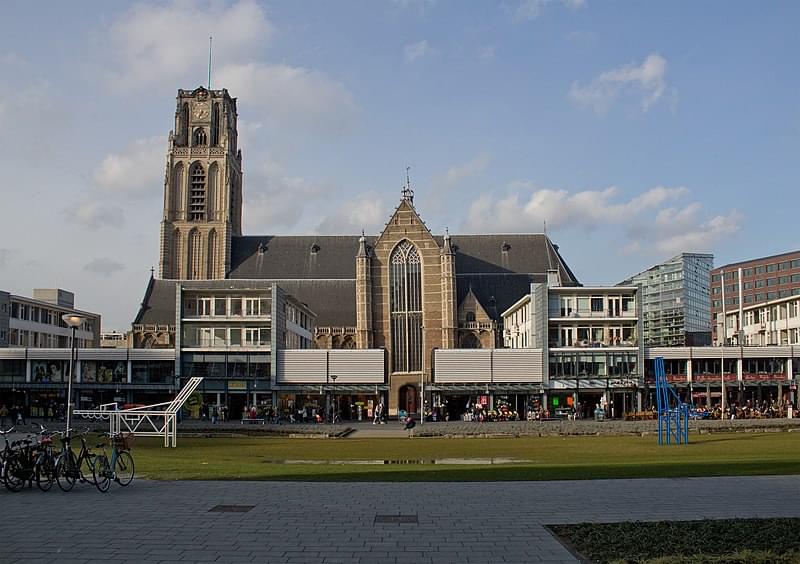
Identify the location of light. (74, 319).